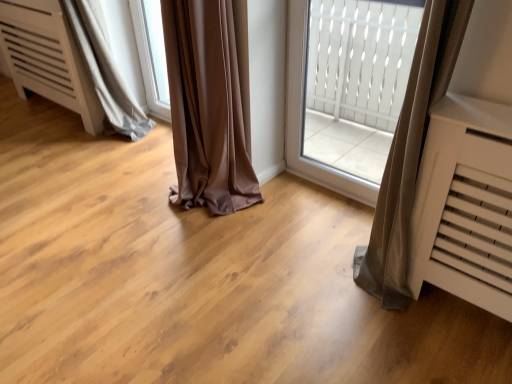
Question: From a real-world perspective, is white textured glass at center positioned under gray satin curtain at lower left based on gravity?

Choices:
 (A) yes
 (B) no

Answer: (B)

Question: Does white textured glass at center lie behind gray satin curtain at lower left?

Choices:
 (A) yes
 (B) no

Answer: (B)

Question: From the image's perspective, does white textured glass at center appear higher than gray satin curtain at lower left?

Choices:
 (A) yes
 (B) no

Answer: (B)

Question: Is white textured glass at center positioned beyond the bounds of gray satin curtain at lower left?

Choices:
 (A) no
 (B) yes

Answer: (B)

Question: Would you consider white textured glass at center to be distant from gray satin curtain at lower left?

Choices:
 (A) no
 (B) yes

Answer: (B)

Question: Is point (140, 117) closer or farther from the camera than point (344, 97)?

Choices:
 (A) closer
 (B) farther

Answer: (A)

Question: From a real-world perspective, is gray satin curtain at lower left physically located above or below white textured glass at center?

Choices:
 (A) above
 (B) below

Answer: (B)

Question: In terms of size, does gray satin curtain at lower left appear bigger or smaller than white textured glass at center?

Choices:
 (A) big
 (B) small

Answer: (A)

Question: Considering the relative positions of gray satin curtain at lower left and white textured glass at center in the image provided, is gray satin curtain at lower left to the left or to the right of white textured glass at center?

Choices:
 (A) right
 (B) left

Answer: (B)

Question: Is point (88, 14) positioned closer to the camera than point (150, 91)?

Choices:
 (A) farther
 (B) closer

Answer: (B)

Question: From the image's perspective, is gray satin curtain at lower left above or below transparent glass window at center?

Choices:
 (A) below
 (B) above

Answer: (A)

Question: Considering their positions, is gray satin curtain at lower left located in front of or behind transparent glass window at center?

Choices:
 (A) front
 (B) behind

Answer: (A)

Question: In terms of width, does gray satin curtain at lower left look wider or thinner when compared to transparent glass window at center?

Choices:
 (A) wide
 (B) thin

Answer: (A)

Question: Considering the positions of white textured glass at center and transparent glass window at center in the image, is white textured glass at center bigger or smaller than transparent glass window at center?

Choices:
 (A) small
 (B) big

Answer: (B)

Question: From a real-world perspective, is white textured glass at center above or below transparent glass window at center?

Choices:
 (A) below
 (B) above

Answer: (B)